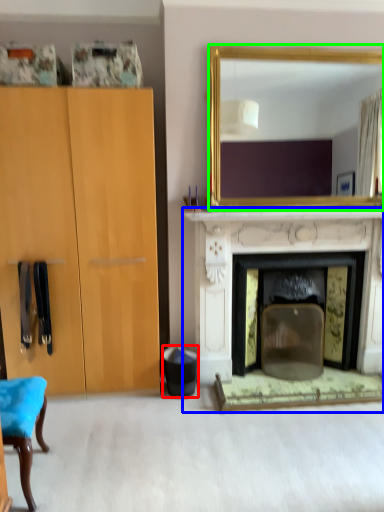
Question: Which object is the closest to the trash bin/can (highlighted by a red box)? Choose among these: fireplace (highlighted by a blue box) or mirror (highlighted by a green box).

Choices:
 (A) fireplace
 (B) mirror

Answer: (A)